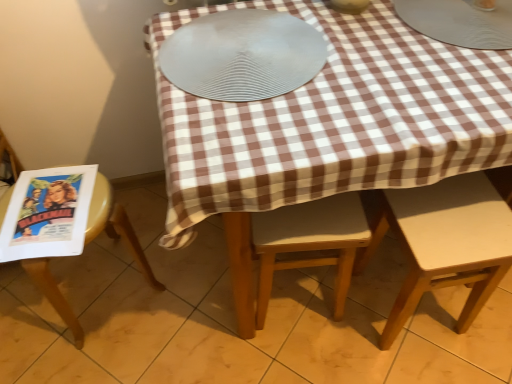
Find the location of a particular element. Image resolution: width=512 pixels, height=384 pixels. metallic silver plate at upper right, the first tableware positioned from the right is located at coordinates (460, 21).

Describe the element at coordinates (349, 6) in the screenshot. I see `metallic silver plate at upper center, which is the first tableware from left to right` at that location.

This screenshot has width=512, height=384. Find the location of `light brown wooden chair at center, arranged as the second chair when viewed from the right`. light brown wooden chair at center, arranged as the second chair when viewed from the right is located at coordinates [309, 242].

The width and height of the screenshot is (512, 384). Describe the element at coordinates (447, 241) in the screenshot. I see `white matte chair at lower right, marked as the 3th chair in a left-to-right arrangement` at that location.

Where is `silver textured platter at center`? Image resolution: width=512 pixels, height=384 pixels. silver textured platter at center is located at coordinates (242, 55).

This screenshot has height=384, width=512. Find the location of `metallic silver plate at upper right, the 2th tableware positioned from the left`. metallic silver plate at upper right, the 2th tableware positioned from the left is located at coordinates (460, 21).

Measure the distance between yellow plastic chair at left, acting as the first chair starting from the left, and silver textured platter at center.

yellow plastic chair at left, acting as the first chair starting from the left, and silver textured platter at center are 22.03 inches apart.

From a real-world perspective, is yellow plastic chair at left, marked as the 3th chair in a right-to-left arrangement, positioned above or below silver textured platter at center?

yellow plastic chair at left, marked as the 3th chair in a right-to-left arrangement, is below silver textured platter at center.

Consider the image. Could you tell me if yellow plastic chair at left, acting as the first chair starting from the left, is turned towards silver textured platter at center?

No, yellow plastic chair at left, acting as the first chair starting from the left, is not turned towards silver textured platter at center.

In the scene shown: Is yellow plastic chair at left, acting as the first chair starting from the left, with silver textured platter at center?

No, yellow plastic chair at left, acting as the first chair starting from the left, is not beside silver textured platter at center.

Does silver textured platter at center have a lesser height compared to metallic silver plate at upper right, the first tableware positioned from the right?

No, silver textured platter at center is not shorter than metallic silver plate at upper right, the first tableware positioned from the right.

Considering the positions of points (231, 58) and (440, 1), is point (231, 58) closer to camera compared to point (440, 1)?

Yes, point (231, 58) is closer to viewer.

The width and height of the screenshot is (512, 384). Identify the location of platter located underneath the metallic silver plate at upper right, the first tableware positioned from the right (from a real-world perspective). (242, 55).

Which object is positioned more to the left, yellow plastic chair at left, acting as the first chair starting from the left, or metallic silver plate at upper right, the 2th tableware positioned from the left?

Positioned to the left is yellow plastic chair at left, acting as the first chair starting from the left.

What's the angular difference between yellow plastic chair at left, marked as the 3th chair in a right-to-left arrangement, and metallic silver plate at upper right, the first tableware positioned from the right,'s facing directions?

35.7 degrees separate the facing orientations of yellow plastic chair at left, marked as the 3th chair in a right-to-left arrangement, and metallic silver plate at upper right, the first tableware positioned from the right.

Based on the photo, is yellow plastic chair at left, acting as the first chair starting from the left, aimed at metallic silver plate at upper right, the first tableware positioned from the right?

No, yellow plastic chair at left, acting as the first chair starting from the left, is not oriented towards metallic silver plate at upper right, the first tableware positioned from the right.

You are a GUI agent. You are given a task and a screenshot of the screen. Output one action in this format:
    pyautogui.click(x=<x>, y=<y>)
    Task: Click on the 2nd chair below when counting from the metallic silver plate at upper right, the 2th tableware positioned from the left (from the image's perspective)
    The height and width of the screenshot is (384, 512).
    Given the screenshot: What is the action you would take?
    pyautogui.click(x=116, y=226)

Where is `platter above the white matte chair at lower right, marked as the 3th chair in a left-to-right arrangement (from a real-world perspective)`? The image size is (512, 384). platter above the white matte chair at lower right, marked as the 3th chair in a left-to-right arrangement (from a real-world perspective) is located at coordinates (242, 55).

Which of these two, silver textured platter at center or white matte chair at lower right, arranged as the 1th chair when viewed from the right, is wider?

silver textured platter at center is wider.

Are silver textured platter at center and white matte chair at lower right, arranged as the 1th chair when viewed from the right, far apart?

No, silver textured platter at center is in close proximity to white matte chair at lower right, arranged as the 1th chair when viewed from the right.

Does silver textured platter at center turn towards white matte chair at lower right, arranged as the 1th chair when viewed from the right?

No.

Which of these two, white matte chair at lower right, arranged as the 1th chair when viewed from the right, or silver textured platter at center, is bigger?

white matte chair at lower right, arranged as the 1th chair when viewed from the right, is bigger.

Is silver textured platter at center surrounded by white matte chair at lower right, arranged as the 1th chair when viewed from the right?

No, silver textured platter at center is not inside white matte chair at lower right, arranged as the 1th chair when viewed from the right.

Is white matte chair at lower right, arranged as the 1th chair when viewed from the right, to the left of silver textured platter at center from the viewer's perspective?

No.

Which is nearer, (x=66, y=254) or (x=354, y=256)?

The point (x=66, y=254) is closer.

Is matte paper comic book at left spatially inside light brown wooden chair at center, placed as the second chair when sorted from left to right, or outside of it?

matte paper comic book at left is located beyond the bounds of light brown wooden chair at center, placed as the second chair when sorted from left to right.

Is matte paper comic book at left oriented towards light brown wooden chair at center, arranged as the second chair when viewed from the right?

No, matte paper comic book at left is not facing towards light brown wooden chair at center, arranged as the second chair when viewed from the right.

Is silver textured platter at center bigger or smaller than light brown wooden chair at center, placed as the second chair when sorted from left to right?

In the image, silver textured platter at center appears to be smaller than light brown wooden chair at center, placed as the second chair when sorted from left to right.

Is silver textured platter at center at the right side of light brown wooden chair at center, placed as the second chair when sorted from left to right?

In fact, silver textured platter at center is to the left of light brown wooden chair at center, placed as the second chair when sorted from left to right.

Is silver textured platter at center turned away from light brown wooden chair at center, arranged as the second chair when viewed from the right?

silver textured platter at center does not have its back to light brown wooden chair at center, arranged as the second chair when viewed from the right.

Starting from the silver textured platter at center, which chair is the 2nd one behind? Please provide its 2D coordinates.

[(116, 226)]

I want to click on the 2nd tableware to the right of the silver textured platter at center, counting from the anchor's position, so click(460, 21).

Considering their positions, is matte paper comic book at left positioned closer to yellow plastic chair at left, acting as the first chair starting from the left, than light brown wooden chair at center, placed as the second chair when sorted from left to right?

Among the two, matte paper comic book at left is located nearer to yellow plastic chair at left, acting as the first chair starting from the left.

Estimate the real-world distances between objects in this image. Which object is closer to matte paper comic book at left, yellow plastic chair at left, marked as the 3th chair in a right-to-left arrangement, or light brown wooden chair at center, placed as the second chair when sorted from left to right?

yellow plastic chair at left, marked as the 3th chair in a right-to-left arrangement, is closer to matte paper comic book at left.

In the scene shown: Which object lies nearer to the anchor point light brown wooden chair at center, arranged as the second chair when viewed from the right, yellow plastic chair at left, marked as the 3th chair in a right-to-left arrangement, or metallic silver plate at upper center, which is the first tableware from left to right?

yellow plastic chair at left, marked as the 3th chair in a right-to-left arrangement, lies closer to light brown wooden chair at center, arranged as the second chair when viewed from the right, than the other object.

Based on the photo, looking at the image, which one is located closer to light brown wooden chair at center, arranged as the second chair when viewed from the right, metallic silver plate at upper center, arranged as the second tableware when viewed from the right, or metallic silver plate at upper right, the first tableware positioned from the right?

The object closer to light brown wooden chair at center, arranged as the second chair when viewed from the right, is metallic silver plate at upper right, the first tableware positioned from the right.

Which object lies nearer to the anchor point silver textured platter at center, white matte chair at lower right, marked as the 3th chair in a left-to-right arrangement, or light brown wooden chair at center, arranged as the second chair when viewed from the right?

light brown wooden chair at center, arranged as the second chair when viewed from the right, lies closer to silver textured platter at center than the other object.

In the scene shown: Estimate the real-world distances between objects in this image. Which object is further from metallic silver plate at upper right, the first tableware positioned from the right, metallic silver plate at upper center, arranged as the second tableware when viewed from the right, or white matte chair at lower right, arranged as the 1th chair when viewed from the right?

The object further to metallic silver plate at upper right, the first tableware positioned from the right, is white matte chair at lower right, arranged as the 1th chair when viewed from the right.

Looking at the image, which one is located closer to yellow plastic chair at left, acting as the first chair starting from the left, matte paper comic book at left or metallic silver plate at upper right, the first tableware positioned from the right?

matte paper comic book at left lies closer to yellow plastic chair at left, acting as the first chair starting from the left, than the other object.

From the image, which object appears to be nearer to yellow plastic chair at left, marked as the 3th chair in a right-to-left arrangement, silver textured platter at center or light brown wooden chair at center, arranged as the second chair when viewed from the right?

Based on the image, light brown wooden chair at center, arranged as the second chair when viewed from the right, appears to be nearer to yellow plastic chair at left, marked as the 3th chair in a right-to-left arrangement.

At what (x,y) coordinates should I click in order to perform the action: click on platter between yellow plastic chair at left, marked as the 3th chair in a right-to-left arrangement, and metallic silver plate at upper right, the 2th tableware positioned from the left. Please return your answer as a coordinate pair (x, y). The image size is (512, 384). Looking at the image, I should click on (242, 55).

The height and width of the screenshot is (384, 512). Identify the location of platter located between matte paper comic book at left and light brown wooden chair at center, placed as the second chair when sorted from left to right, in the left-right direction. point(242,55).

In order to click on platter that lies between metallic silver plate at upper center, arranged as the second tableware when viewed from the right, and light brown wooden chair at center, placed as the second chair when sorted from left to right, from top to bottom in this screenshot , I will do `click(242, 55)`.

Find the location of a particular element. Image resolution: width=512 pixels, height=384 pixels. platter between matte paper comic book at left and white matte chair at lower right, marked as the 3th chair in a left-to-right arrangement, from left to right is located at coordinates (242, 55).